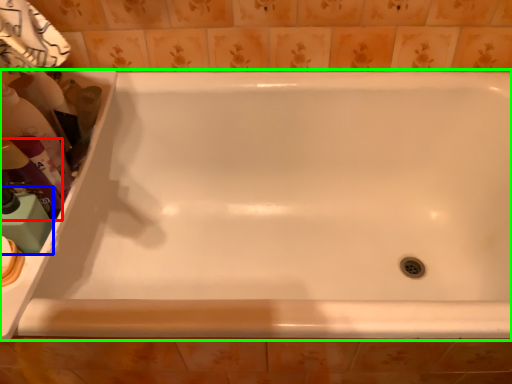
Question: Based on their relative distances, which object is farther from cleaning product (highlighted by a red box)? Choose from cleaning product (highlighted by a blue box) and bathtub (highlighted by a green box).

Choices:
 (A) cleaning product
 (B) bathtub

Answer: (B)